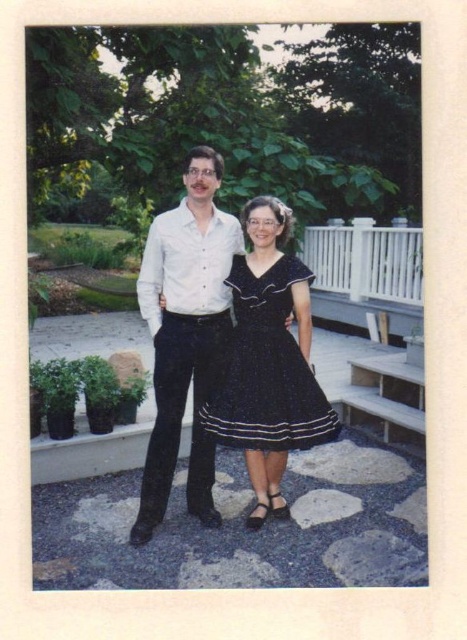
Question: Among these points, which one is farthest from the camera?

Choices:
 (A) (205, 372)
 (B) (216, 422)

Answer: (A)

Question: Which object is farther from the camera taking this photo?

Choices:
 (A) dark blue satin dress at center
 (B) white glossy shirt at center

Answer: (A)

Question: Considering the relative positions of white glossy shirt at center and dark blue satin dress at center in the image provided, where is white glossy shirt at center located with respect to dark blue satin dress at center?

Choices:
 (A) above
 (B) below

Answer: (A)

Question: Does white glossy shirt at center appear on the left side of dark blue satin dress at center?

Choices:
 (A) no
 (B) yes

Answer: (B)

Question: Is white glossy shirt at center wider than dark blue satin dress at center?

Choices:
 (A) yes
 (B) no

Answer: (B)